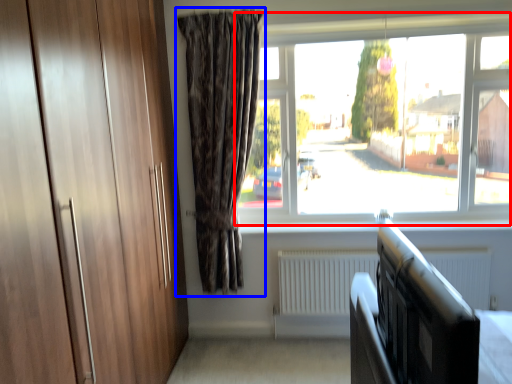
Question: Which of the following is the closest to the observer, window (highlighted by a red box) or curtain (highlighted by a blue box)?

Choices:
 (A) window
 (B) curtain

Answer: (B)